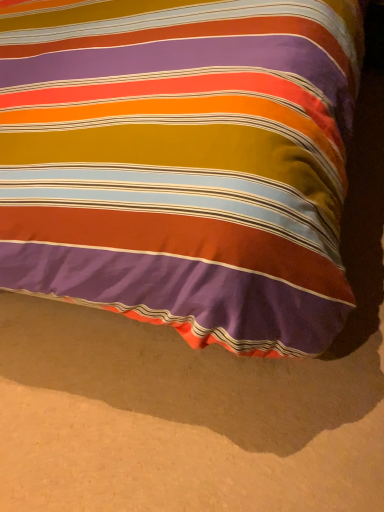
The image size is (384, 512). Identify the location of satin striped pillow at center. (181, 162).

This screenshot has width=384, height=512. Describe the element at coordinates (181, 162) in the screenshot. I see `satin striped pillow at center` at that location.

Where is `satin striped pillow at center`? satin striped pillow at center is located at coordinates (181, 162).